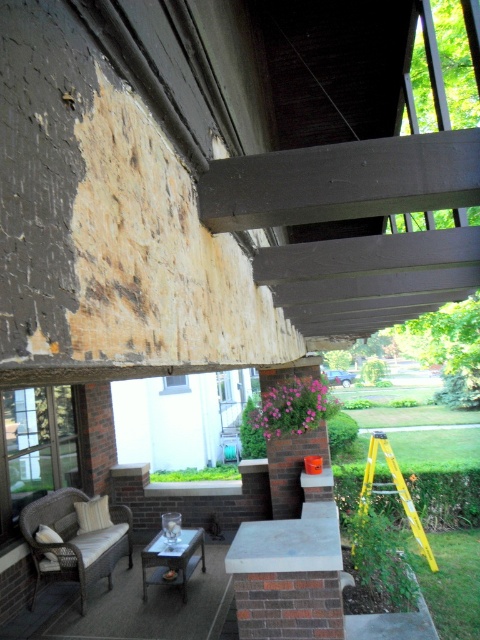
Question: Among these objects, which one is nearest to the camera?

Choices:
 (A) yellow fiberglass ladder at lower right
 (B) wicker cushioned chair at lower left

Answer: (B)

Question: Can you confirm if wicker cushioned chair at lower left is positioned to the left of yellow fiberglass ladder at lower right?

Choices:
 (A) yes
 (B) no

Answer: (A)

Question: Among these objects, which one is nearest to the camera?

Choices:
 (A) yellow fiberglass ladder at lower right
 (B) wicker cushioned chair at lower left

Answer: (B)

Question: Can you confirm if wicker cushioned chair at lower left is positioned to the left of yellow fiberglass ladder at lower right?

Choices:
 (A) no
 (B) yes

Answer: (B)

Question: Does wicker cushioned chair at lower left appear on the right side of yellow fiberglass ladder at lower right?

Choices:
 (A) no
 (B) yes

Answer: (A)